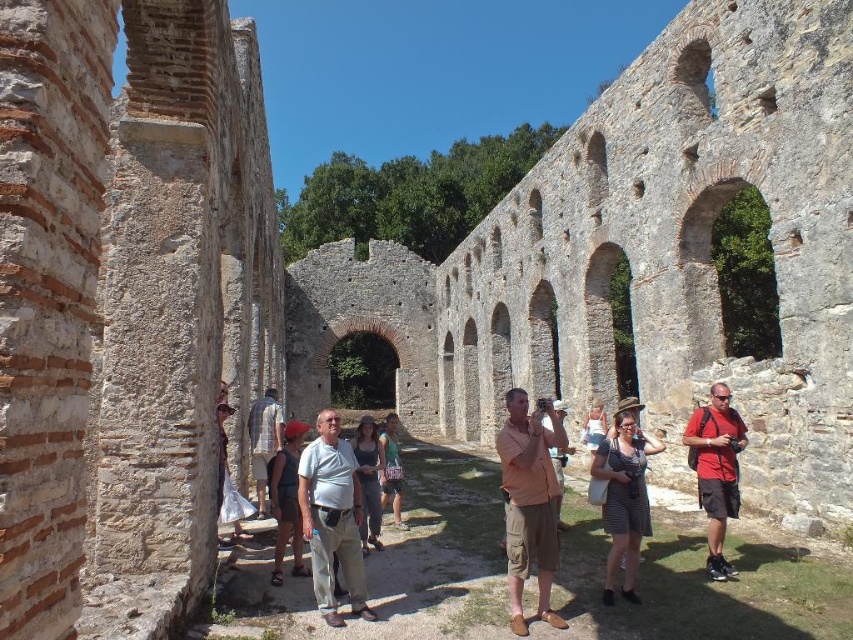
Question: Is the position of tan cotton shirt at center less distant than that of striped cotton dress at center?

Choices:
 (A) no
 (B) yes

Answer: (B)

Question: Which point is closer to the camera?

Choices:
 (A) tan cotton shirt at center
 (B) red matte shirt at center

Answer: (A)

Question: Among these objects, which one is farthest from the camera?

Choices:
 (A) denim shorts at center
 (B) white cotton shirt at center

Answer: (A)

Question: Is stone wall at left smaller than red matte shirt at center?

Choices:
 (A) no
 (B) yes

Answer: (A)

Question: Is red matte shirt at center to the left of light brown leather pants at center from the viewer's perspective?

Choices:
 (A) yes
 (B) no

Answer: (B)

Question: Which of the following is the farthest from the observer?

Choices:
 (A) white cotton shirt at center
 (B) denim shorts at center

Answer: (B)